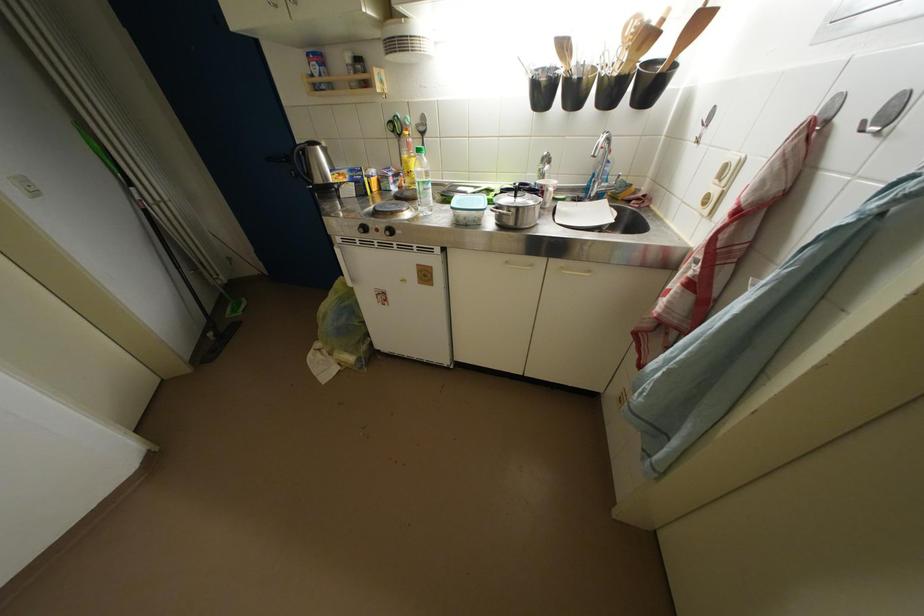
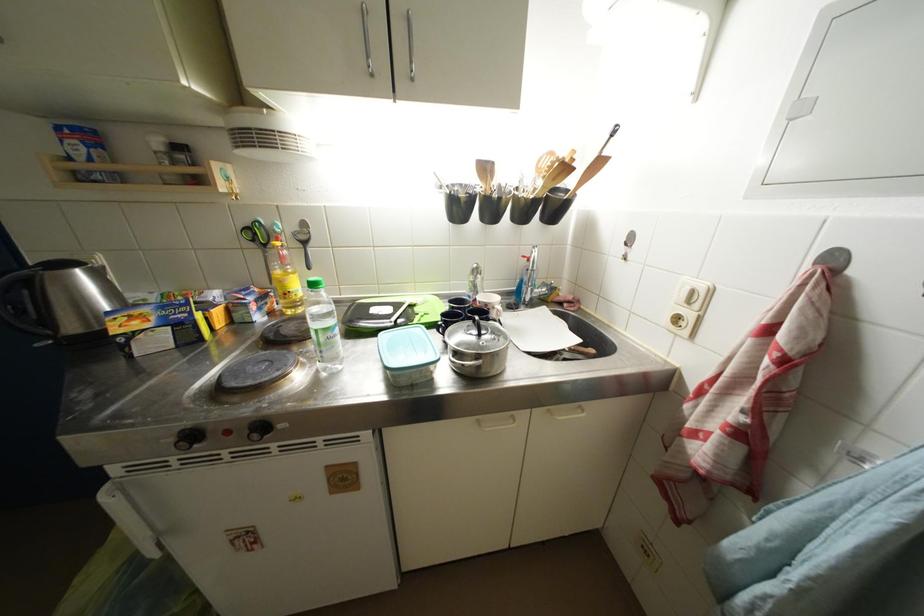
Where in the second image is the point corresponding to point 428,193 from the first image?

(329, 344)